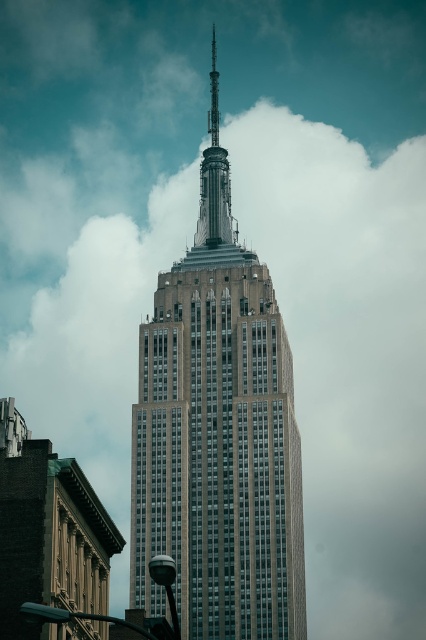
Is gray stone tower at center positioned before polished silver spire at center?

Yes.

Is point (259, 392) behind point (229, 173)?

That is False.

Does point (284, 333) lie in front of point (230, 236)?

Yes, point (284, 333) is in front of point (230, 236).

In order to click on gray stone tower at center in this screenshot , I will do `click(218, 435)`.